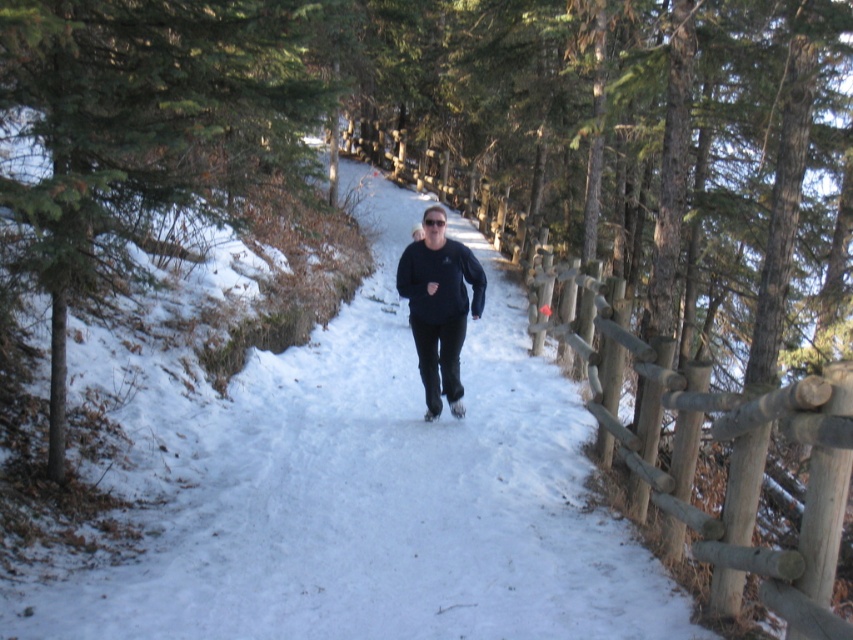
Between green evergreen tree at left and wooden fence at center-right, which one has less height?

Standing shorter between the two is green evergreen tree at left.

Where is `green evergreen tree at left`? The image size is (853, 640). green evergreen tree at left is located at coordinates (131, 129).

How distant is wooden fence at center-right from black matte pants at center?

wooden fence at center-right is 2.07 meters from black matte pants at center.

Can you confirm if wooden fence at center-right is positioned below black matte pants at center?

Indeed, wooden fence at center-right is positioned under black matte pants at center.

Where is `wooden fence at center-right`? wooden fence at center-right is located at coordinates [712, 440].

Locate an element on the screen. The height and width of the screenshot is (640, 853). wooden fence at center-right is located at coordinates (712, 440).

Is green evergreen tree at left to the left of black matte pants at center from the viewer's perspective?

Indeed, green evergreen tree at left is positioned on the left side of black matte pants at center.

Can you confirm if green evergreen tree at left is positioned above black matte pants at center?

Yes, green evergreen tree at left is above black matte pants at center.

Who is more forward, (x=49, y=76) or (x=442, y=221)?

Point (x=49, y=76)

Locate an element on the screen. The height and width of the screenshot is (640, 853). green evergreen tree at left is located at coordinates (131, 129).